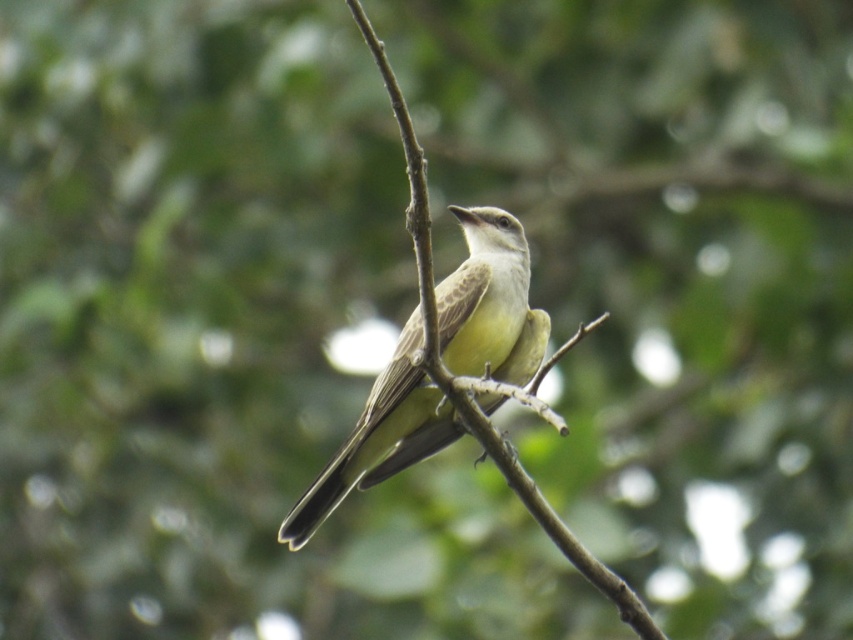
You are an ornithologist observing a bird in a forest. You notice the light brown feathers at center and the brown wood tree branch at center. Which object appears shorter in the image?

The light brown feathers at center appears shorter than the brown wood tree branch at center.

You are an ornithologist observing the bird in the image. The coordinates point to a specific feature. What color are the feathers at the coordinates point (x=490, y=301)?

The feathers at point (x=490, y=301) are light brown.

You are an ornithologist analyzing the image. You need to locate the light brown feathers at center for a study. According to the coordinates provided, where exactly would you find them in the image?

The light brown feathers at center are located at the coordinates point (490, 301).